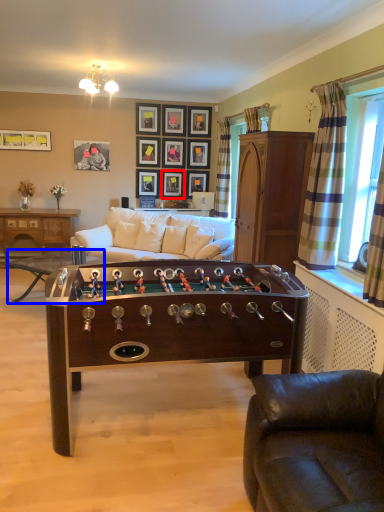
Question: Which object is further to the camera taking this photo, picture frame (highlighted by a red box) or table (highlighted by a blue box)?

Choices:
 (A) picture frame
 (B) table

Answer: (A)